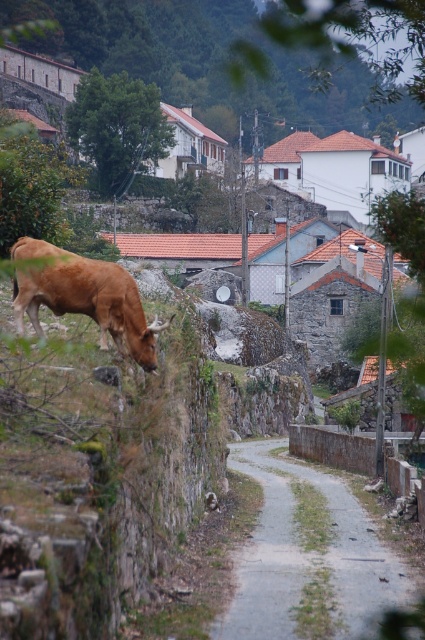
Does gray gravel path at center appear over brown matte bull at left?

Actually, gray gravel path at center is below brown matte bull at left.

Describe the element at coordinates (306, 554) in the screenshot. I see `gray gravel path at center` at that location.

Image resolution: width=425 pixels, height=640 pixels. Identify the location of gray gravel path at center. (306, 554).